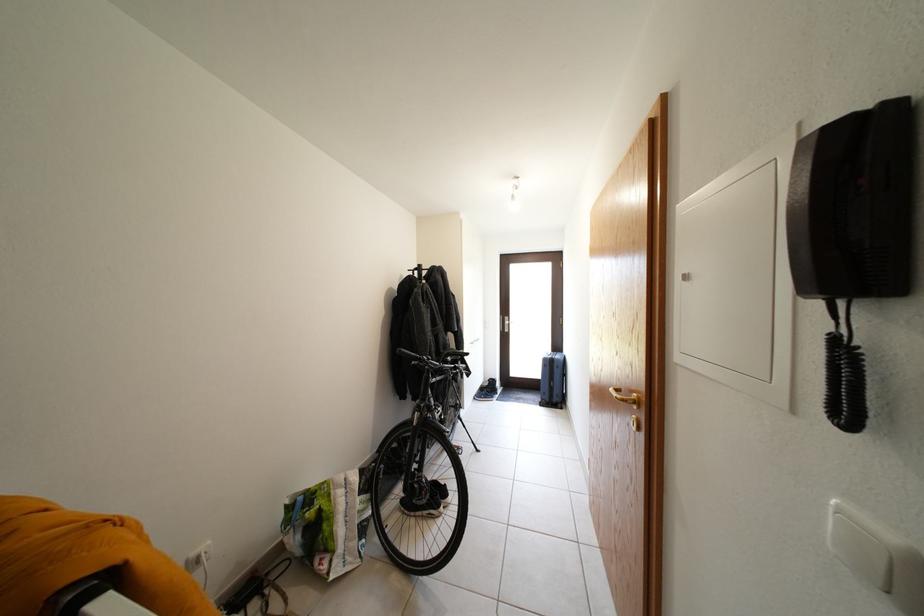
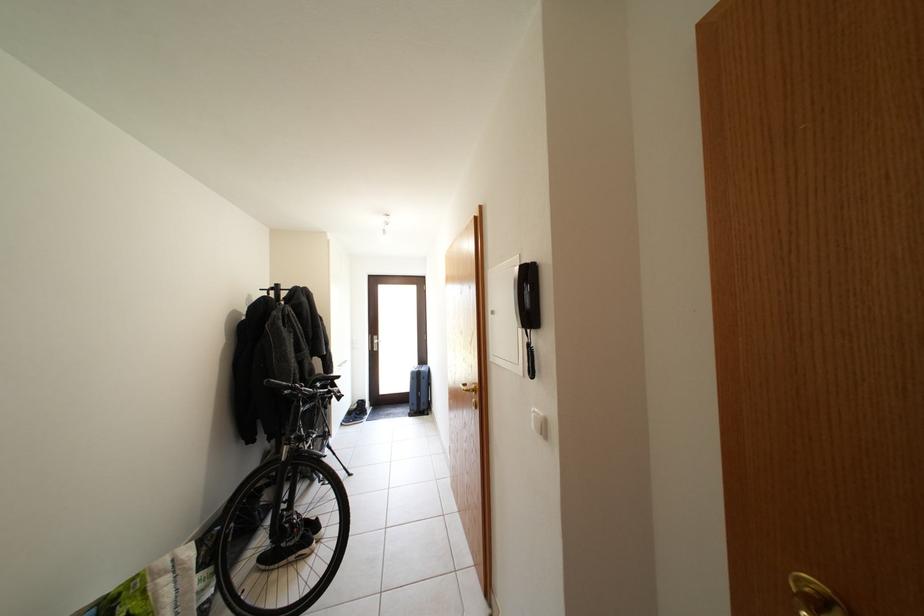
Find the pixel in the second image that matches point 857,519 in the first image.

(543, 418)